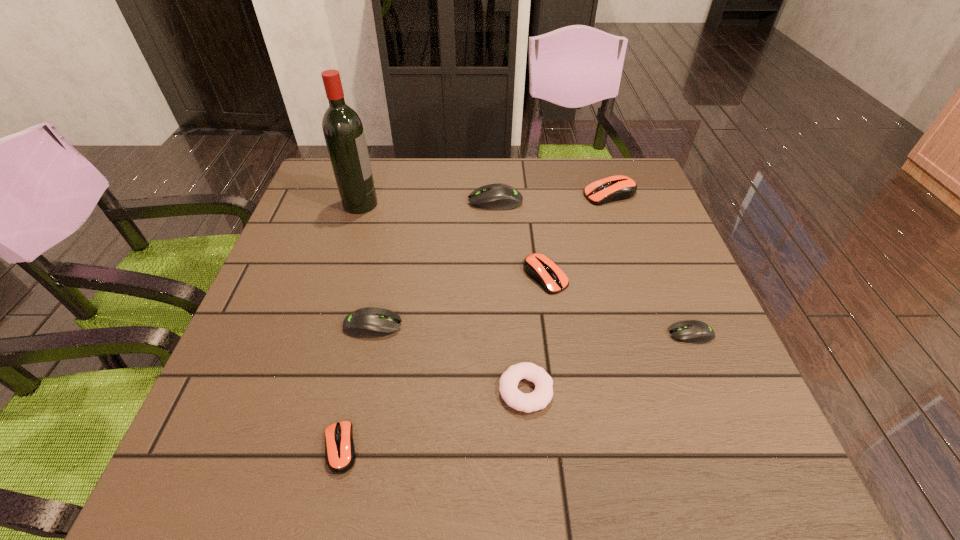
You are a GUI agent. You are given a task and a screenshot of the screen. Output one action in this format:
    pyautogui.click(x=<x>, y=<y>)
    Task: Click on the doughnut
    
    Given the screenshot: What is the action you would take?
    pyautogui.click(x=538, y=399)

I want to click on the nearest object, so click(x=340, y=454).

Find the location of `the nearest computer mouse`. the nearest computer mouse is located at coordinates (340, 454).

Locate an element on the screen. This screenshot has height=540, width=960. vacant space located on the label of the tallest object is located at coordinates (411, 204).

The width and height of the screenshot is (960, 540). Find the location of `free spot located 0.380m on the wheel side of the second gray computer mouse from right to left`. free spot located 0.380m on the wheel side of the second gray computer mouse from right to left is located at coordinates (328, 201).

What are the coordinates of `free region located 0.130m on the wheel side of the second gray computer mouse from right to left` in the screenshot? It's located at tap(420, 201).

The height and width of the screenshot is (540, 960). In order to click on vacant space located on the wheel side of the second gray computer mouse from right to left in this screenshot , I will do `click(335, 201)`.

The image size is (960, 540). In order to click on free spot located on the left of the rightmost orange computer mouse in this screenshot , I will do `click(508, 194)`.

This screenshot has width=960, height=540. In order to click on blank space located 0.240m on the wheel side of the second smallest gray computer mouse in this screenshot , I will do `click(519, 326)`.

Locate an element on the screen. free space located on the back of the second orange computer mouse from right to left is located at coordinates 532,182.